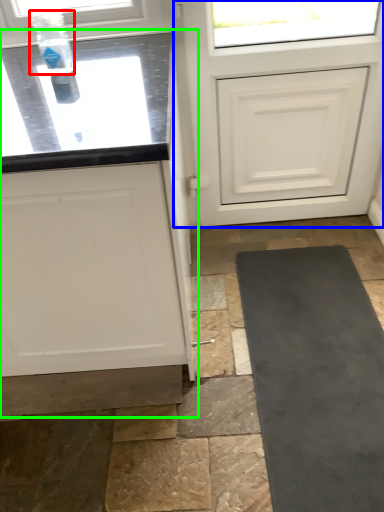
Question: Which object is the closest to the bottle (highlighted by a red box)? Choose among these: door (highlighted by a blue box) or cabinetry (highlighted by a green box).

Choices:
 (A) door
 (B) cabinetry

Answer: (B)